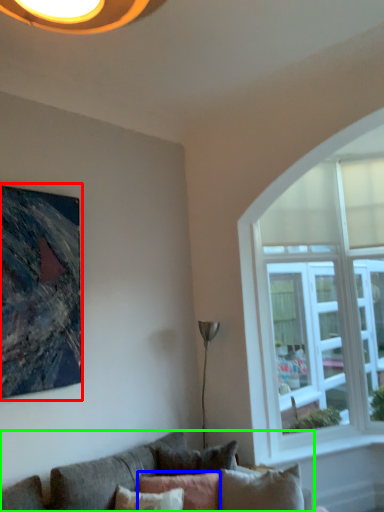
Question: Estimate the real-world distances between objects in this image. Which object is closer to picture frame (highlighted by a red box), pillow (highlighted by a blue box) or studio couch (highlighted by a green box)?

Choices:
 (A) pillow
 (B) studio couch

Answer: (B)